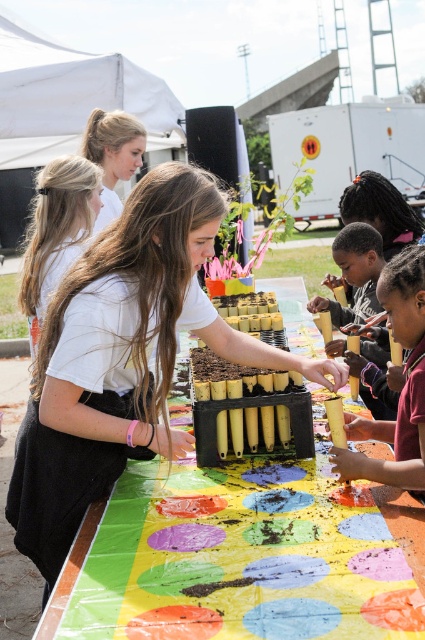
You are a photographer standing behind the long table and want to take a photo of the white matte shirt at center and the matte yellow pencil at center. Which object will appear larger in the photo?

The white matte shirt at center will appear larger in the photo because it is bigger than the matte yellow pencil at center.

Based on the photo, you are a photographer standing behind the long table and want to take a photo of both the white matte shirt at center and the matte yellow pencil at center. Which object will appear closer to the camera in the photo?

The white matte shirt at center will appear closer to the camera in the photo because it is further to the viewer than the matte yellow pencil at center, meaning it is positioned nearer to the photographer.